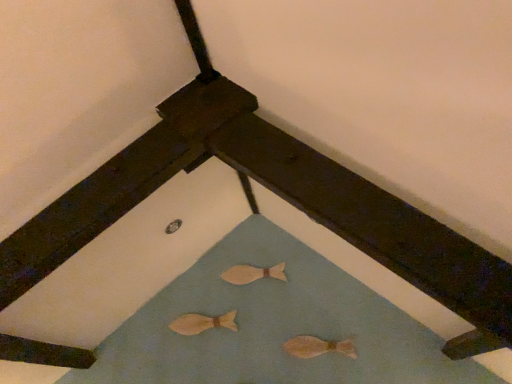
Question: In terms of size, does light brown wooden fish at lower center, which appears as the third animal when viewed from the back, appear bigger or smaller than wooden fish at center, acting as the third animal starting from the front?

Choices:
 (A) big
 (B) small

Answer: (A)

Question: Is light brown wooden fish at lower center, which is counted as the 1th animal, starting from the front, inside the boundaries of wooden fish at center, acting as the third animal starting from the bottom, or outside?

Choices:
 (A) outside
 (B) inside

Answer: (A)

Question: Considering the real-world distances, which object is farthest from the wooden fish at center, the 2th animal positioned from the bottom?

Choices:
 (A) light brown wooden fish at lower center, which is the 3th animal in left-to-right order
 (B) wooden fish at center, the 2th animal in the right-to-left sequence

Answer: (A)

Question: Which of these objects is positioned farthest from the wooden fish at center, acting as the third animal starting from the front?

Choices:
 (A) wooden fish at center, which is counted as the 2th animal, starting from the front
 (B) light brown wooden fish at lower center, which is counted as the 1th animal, starting from the front

Answer: (B)